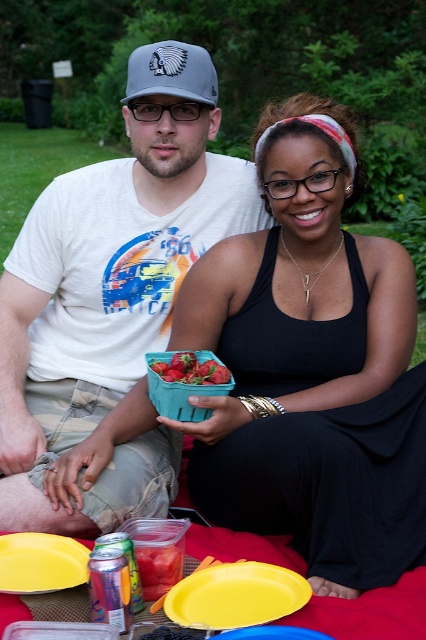
Question: Observing the image, what is the correct spatial positioning of ripe strawberry at center in reference to yellow plastic plate at center?

Choices:
 (A) left
 (B) right

Answer: (A)

Question: Which point is farther to the camera?

Choices:
 (A) (60, 211)
 (B) (20, 544)

Answer: (A)

Question: From the image, what is the correct spatial relationship of black matte tank top at center in relation to yellow plastic plate at lower center?

Choices:
 (A) above
 (B) below

Answer: (A)

Question: Is yellow plastic plate at lower center positioned at the back of gray fabric baseball cap at upper center?

Choices:
 (A) yes
 (B) no

Answer: (B)

Question: Which of the following is the farthest from the observer?

Choices:
 (A) (43, 570)
 (B) (298, 580)
 (C) (259, 636)
 (D) (190, 81)

Answer: (D)

Question: Which point appears closest to the camera in this image?

Choices:
 (A) (282, 572)
 (B) (244, 632)
 (C) (158, 51)

Answer: (B)